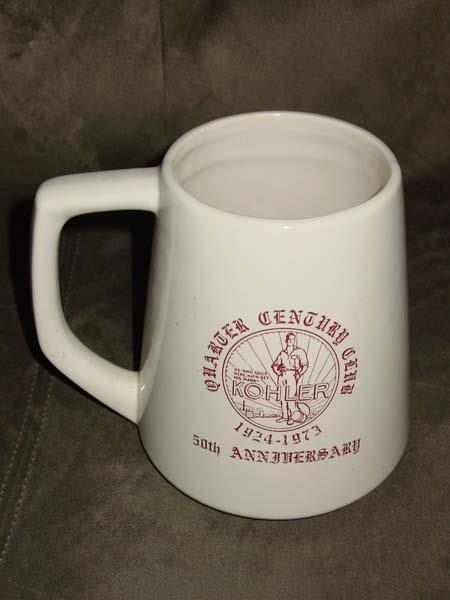
The width and height of the screenshot is (450, 600). I want to click on white mug, so pyautogui.click(x=234, y=335).